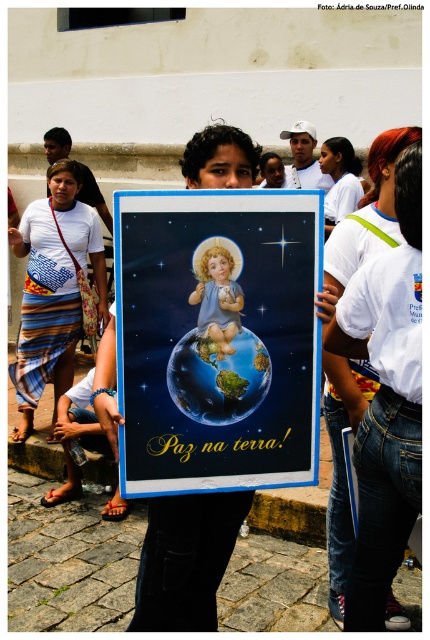
Between striped fabric skirt at center and white fabric shirt at upper center, which one is positioned lower?

Positioned lower is striped fabric skirt at center.

Which of these two, striped fabric skirt at center or white fabric shirt at upper center, stands shorter?

Standing shorter between the two is white fabric shirt at upper center.

This screenshot has height=640, width=430. What are the coordinates of `striped fabric skirt at center` in the screenshot? It's located at (52, 289).

Who is more forward, [205,275] or [334,214]?

Point [205,275]

Is smooth porcelain baby at center shorter than white fabric shirt at upper center?

Yes, smooth porcelain baby at center is shorter than white fabric shirt at upper center.

Which is behind, point (215, 339) or point (346, 188)?

Positioned behind is point (346, 188).

Find the location of a particular element. Image resolution: width=430 pixels, height=640 pixels. smooth porcelain baby at center is located at coordinates (218, 300).

Can you confirm if matte plastic poster at center is positioned to the left of smooth porcelain baby at center?

In fact, matte plastic poster at center is to the right of smooth porcelain baby at center.

At what (x,y) coordinates should I click in order to perform the action: click on matte plastic poster at center. Please return your answer as a coordinate pair (x, y). The width and height of the screenshot is (430, 640). Looking at the image, I should click on (214, 342).

The height and width of the screenshot is (640, 430). I want to click on matte plastic poster at center, so click(x=214, y=342).